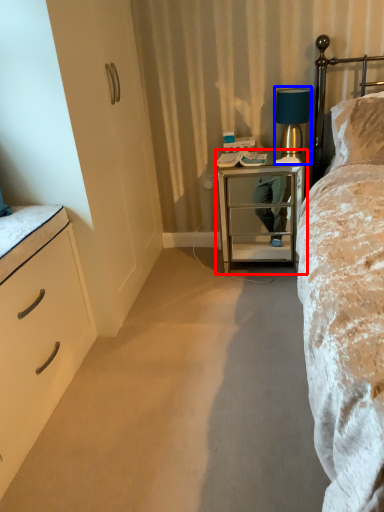
Question: Which point is closer to the camera, nightstand (highlighted by a red box) or table lamp (highlighted by a blue box)?

Choices:
 (A) nightstand
 (B) table lamp

Answer: (A)